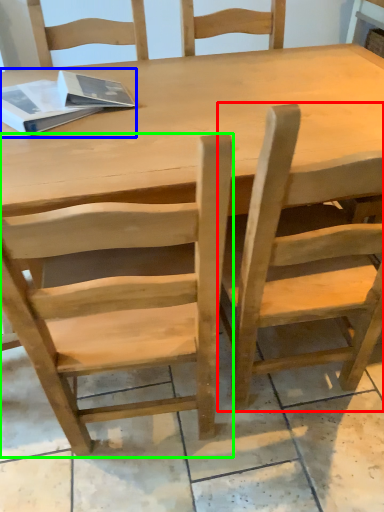
Question: Which object is the farthest from chair (highlighted by a red box)? Choose among these: book (highlighted by a blue box) or chair (highlighted by a green box).

Choices:
 (A) book
 (B) chair

Answer: (A)